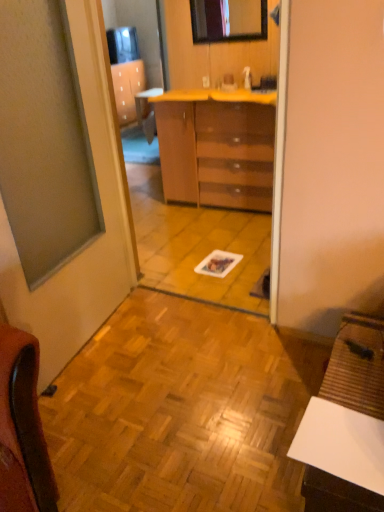
What are the coordinates of `vacant region in front of matte glass window at left` in the screenshot? It's located at (128, 419).